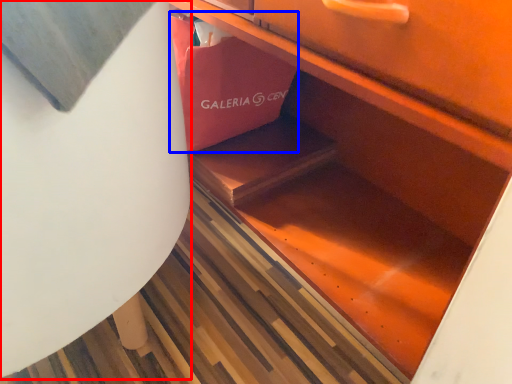
Question: Among these objects, which one is farthest to the camera, round table (highlighted by a red box) or shopping bag (highlighted by a blue box)?

Choices:
 (A) round table
 (B) shopping bag

Answer: (B)